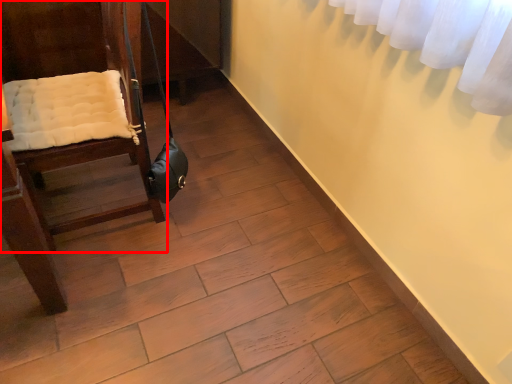
Question: Where is furniture (annotated by the red box) located in relation to shoulder bag in the image?

Choices:
 (A) left
 (B) right

Answer: (A)